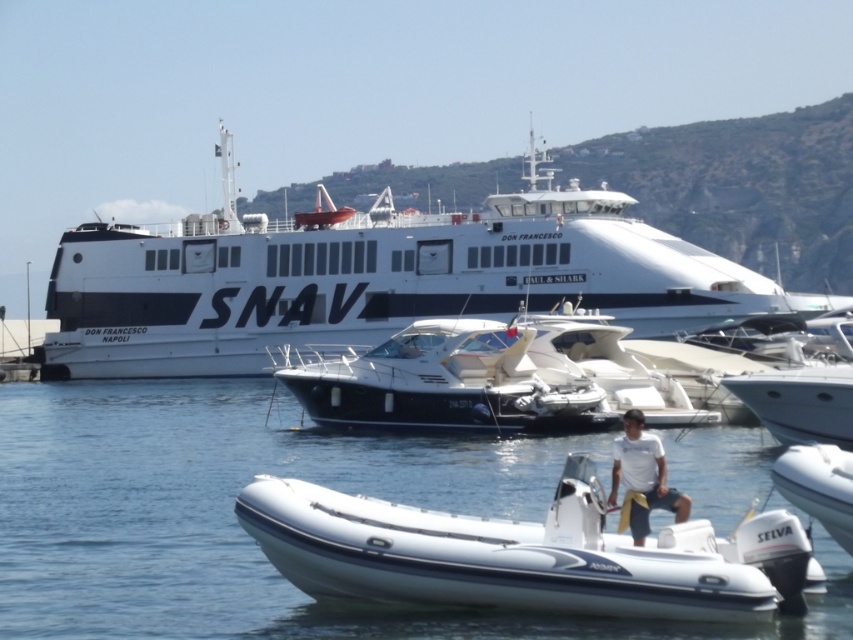
How far apart are white rubber boat at center and white rubber dinghy at center?

7.21 meters

Find the location of a particular element. white rubber boat at center is located at coordinates (242, 529).

Identify the location of white rubber boat at center. (242, 529).

The height and width of the screenshot is (640, 853). I want to click on white rubber boat at center, so click(242, 529).

Between white matte ferry boat at upper center and white cotton shirt at center, which one is positioned lower?

Positioned lower is white cotton shirt at center.

Who is shorter, white matte ferry boat at upper center or white cotton shirt at center?

With less height is white cotton shirt at center.

Is point (148, 301) positioned after point (668, 508)?

That is True.

Image resolution: width=853 pixels, height=640 pixels. In order to click on white matte ferry boat at upper center in this screenshot , I will do `click(376, 276)`.

Between point (430, 552) and point (631, 461), which one is positioned in front?

Positioned in front is point (430, 552).

Does white rubber dinghy at center appear on the right side of white cotton shirt at center?

No, white rubber dinghy at center is not to the right of white cotton shirt at center.

Does point (335, 564) lie behind point (618, 451)?

No, it is in front of (618, 451).

Identify the location of white rubber dinghy at center. (526, 554).